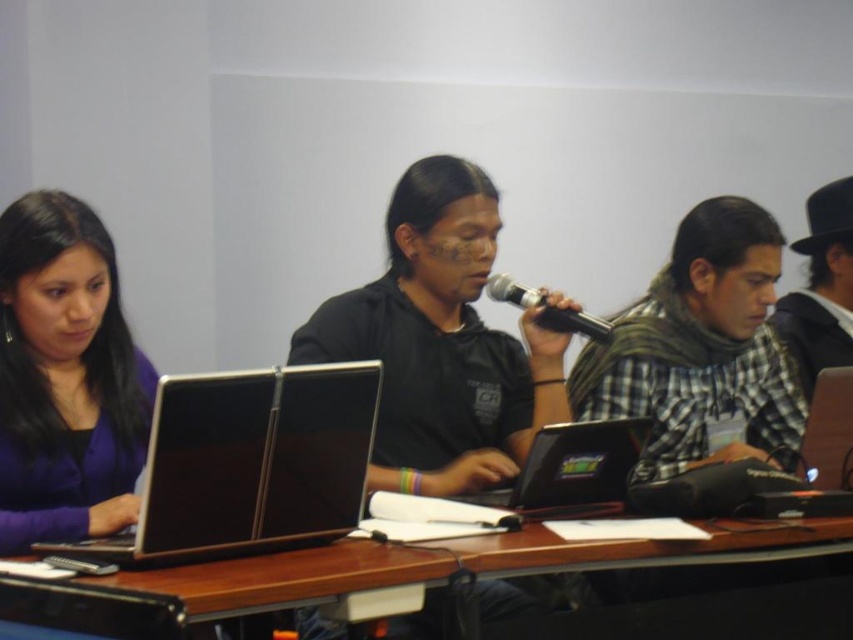
You are organizing a photo shoot and need to place a prop exactly at the coordinates mentioned in the scene. Where should you place the checkered fabric scarf at right?

The checkered fabric scarf at right should be placed at the coordinates point (701,349).

You are organizing a presentation and need to ensure that the microphone is visible to all attendees. Given the purple matte shirt at left and the black matte microphone at center, which object is larger and might obstruct the microphone if positioned too closely?

The purple matte shirt at left is bigger than the black matte microphone at center, so it could potentially obstruct the microphone if placed too close.